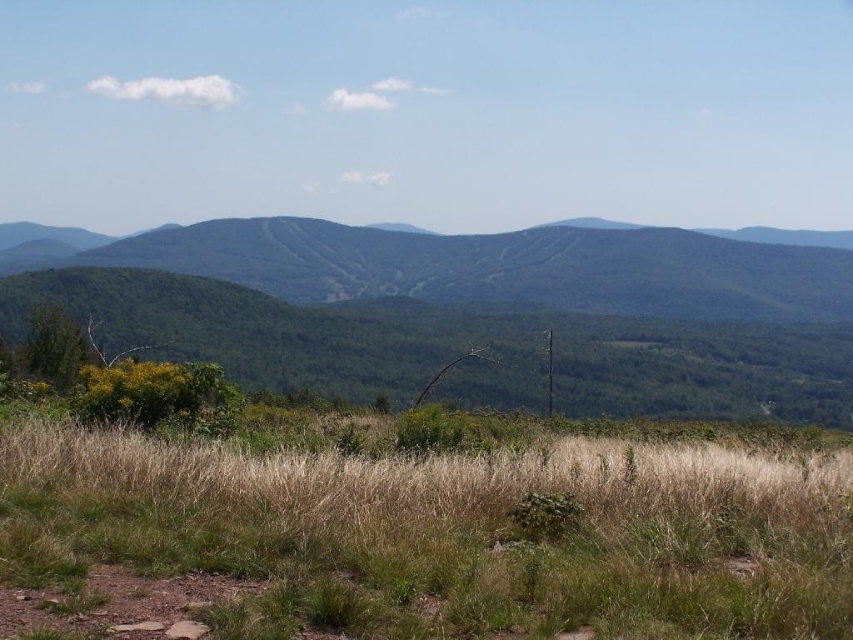
Question: Can you confirm if green grassy field at center is bigger than green forested mountain at center?

Choices:
 (A) no
 (B) yes

Answer: (A)

Question: Is green grassy field at center positioned before green forested mountain at center?

Choices:
 (A) yes
 (B) no

Answer: (A)

Question: Can you confirm if green grassy field at center is wider than green forested mountain at center?

Choices:
 (A) no
 (B) yes

Answer: (A)

Question: Which object appears closest to the camera in this image?

Choices:
 (A) green grassy field at center
 (B) green forested mountain at center

Answer: (A)